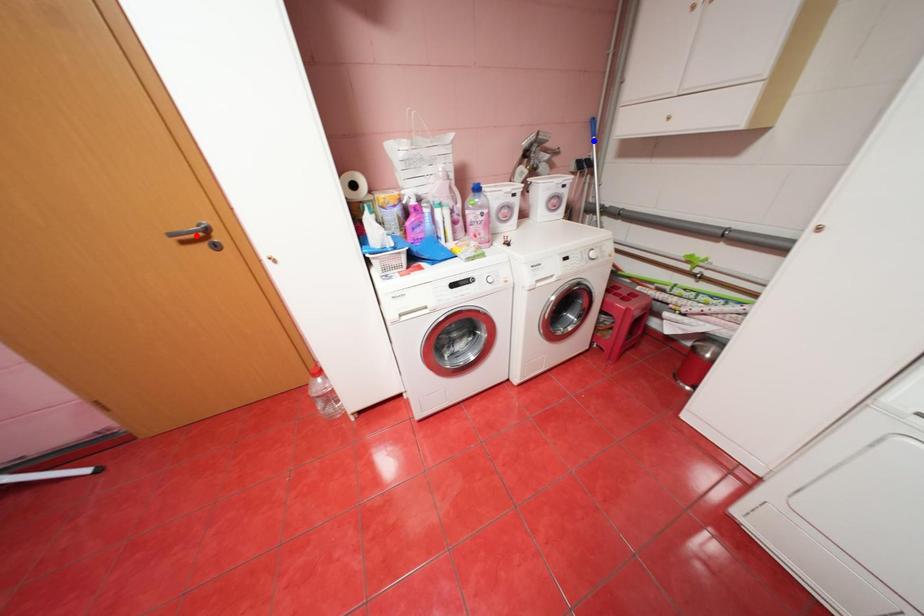
Question: In the image, two points are highlighted. Which point is nearer to the camera? Reply with the corresponding letter.

Choices:
 (A) blue point
 (B) red point

Answer: (B)